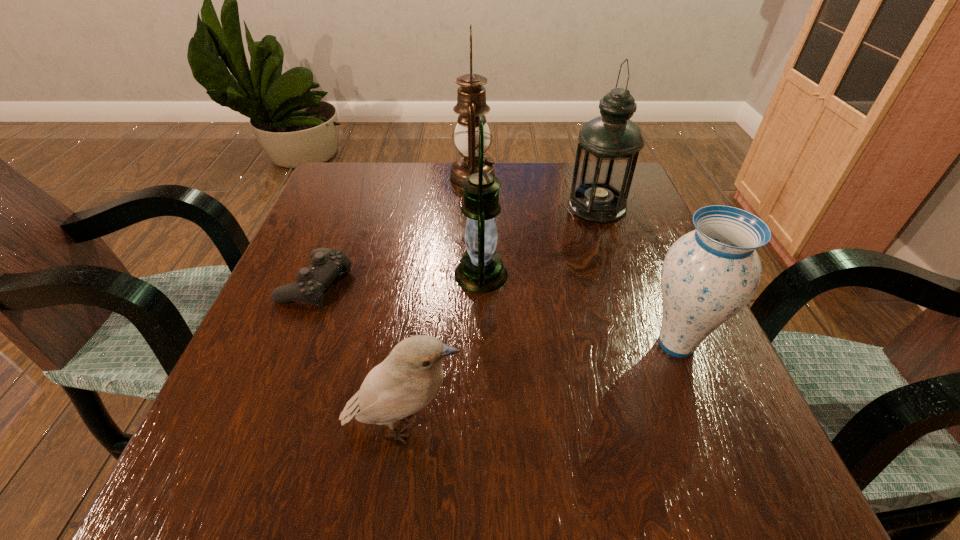
This screenshot has width=960, height=540. What are the coordinates of `vacant area between the fifth farthest object and the fifth tallest object` in the screenshot? It's located at (540, 385).

Image resolution: width=960 pixels, height=540 pixels. Identify the location of free area in between the control and the bird. (360, 354).

Locate an element on the screen. The image size is (960, 540). free space between the lantern and the control is located at coordinates (398, 278).

Where is `vacant area that lies between the right oil lamp and the leftmost object`? vacant area that lies between the right oil lamp and the leftmost object is located at coordinates (457, 244).

This screenshot has height=540, width=960. I want to click on vacant region between the left oil lamp and the leftmost object, so click(395, 230).

The image size is (960, 540). In order to click on vacant space in between the nearest object and the left oil lamp in this screenshot , I will do `click(438, 302)`.

Identify the location of empty space that is in between the second shortest object and the left oil lamp. (438, 302).

Identify the location of free point between the fourth tallest object and the nearest object. The image size is (960, 540). (540, 385).

Locate an element on the screen. The width and height of the screenshot is (960, 540). unoccupied area between the bird and the control is located at coordinates (360, 354).

Point out which object is positioned as the nearest to the right oil lamp. Please provide its 2D coordinates. Your answer should be formatted as a tuple, i.e. [(x, y)], where the tuple contains the x and y coordinates of a point satisfying the conditions above.

[(471, 96)]